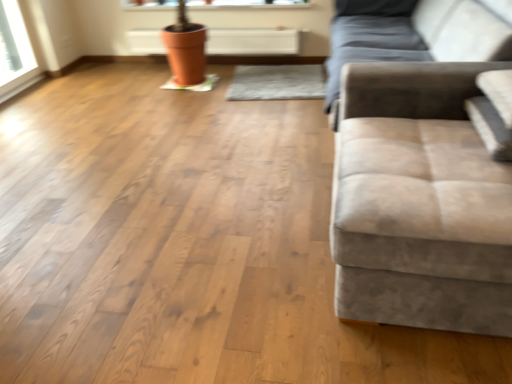
Locate an element on the screen. The width and height of the screenshot is (512, 384). free region on the left part of suede-like beige studio couch at right is located at coordinates (247, 268).